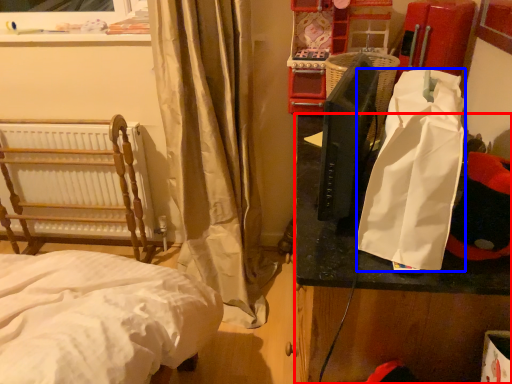
Question: Which point is further to the camera, table (highlighted by a red box) or shopping bag (highlighted by a blue box)?

Choices:
 (A) table
 (B) shopping bag

Answer: (A)